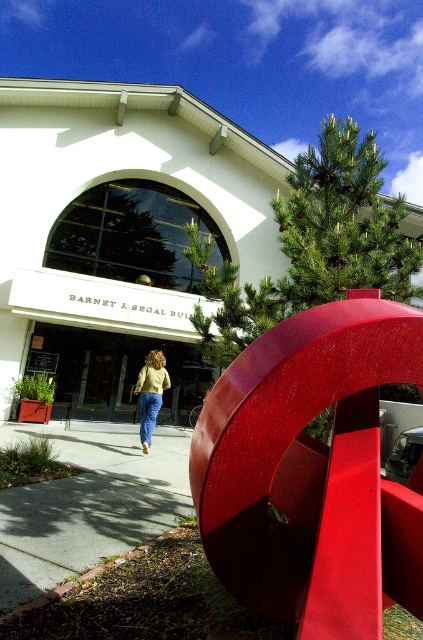
Locate an element on the screen. gray concrete sidewalk at lower left is located at coordinates (88, 500).